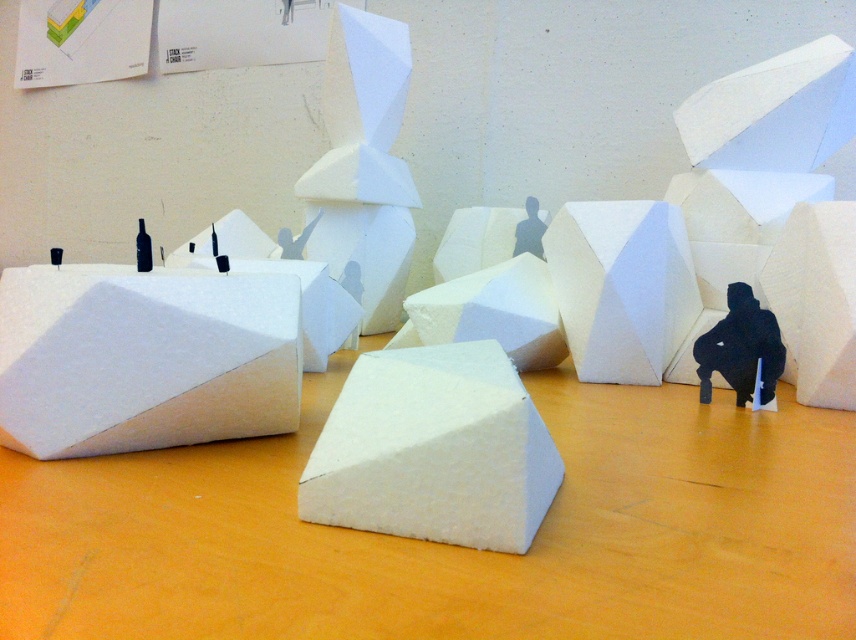
Does point (158, 289) come farther from viewer compared to point (477, 307)?

No, (158, 289) is in front of (477, 307).

Is white matte foam block at left to the right of white matte foam at center from the viewer's perspective?

In fact, white matte foam block at left is to the left of white matte foam at center.

Where is `white matte foam block at left`? white matte foam block at left is located at coordinates (144, 360).

Which is more to the right, white matte hexagonal block at center-right or black matte figure at center?

white matte hexagonal block at center-right

Can you confirm if white matte hexagonal block at center-right is positioned above black matte figure at center?

Incorrect, white matte hexagonal block at center-right is not positioned above black matte figure at center.

You are a GUI agent. You are given a task and a screenshot of the screen. Output one action in this format:
    pyautogui.click(x=<x>, y=<y>)
    Task: Click on the white matte hexagonal block at center-right
    This screenshot has width=856, height=640.
    Given the screenshot: What is the action you would take?
    pyautogui.click(x=622, y=285)

Does white matte foam block at left appear on the right side of white matte hexagonal block at center-right?

No, white matte foam block at left is not to the right of white matte hexagonal block at center-right.

Between point (28, 372) and point (586, 253), which one is positioned behind?

Positioned behind is point (586, 253).

Between point (103, 442) and point (638, 230), which one is positioned in front?

Point (103, 442) is in front.

Find the location of a particular element. Image resolution: width=856 pixels, height=640 pixels. white matte foam block at left is located at coordinates (144, 360).